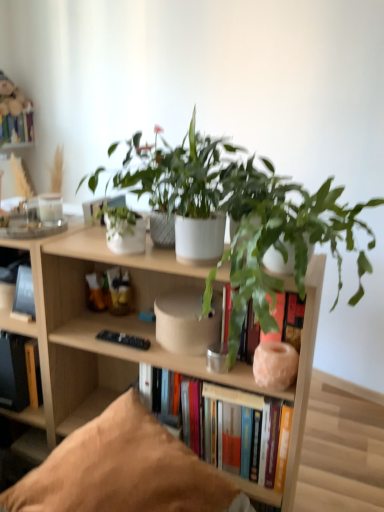
Question: Does point (29, 112) appear closer or farther from the camera than point (9, 497)?

Choices:
 (A) farther
 (B) closer

Answer: (A)

Question: Visually, is hardcover book at upper left, placed as the fourth book when sorted from bottom to top, positioned to the left or to the right of brown fabric pillow at lower center?

Choices:
 (A) left
 (B) right

Answer: (A)

Question: Which object is positioned farthest from the green matte plant at center, positioned as the 1th houseplant in right-to-left order?

Choices:
 (A) hardcover book at upper left, the fourth book when ordered from right to left
 (B) brown fabric pillow at lower center
 (C) white matte pot at upper center, which is the second houseplant in right-to-left order
 (D) hardcover books at center, which is the fourth book in top-to-bottom order
 (E) matte pink stone vase at center

Answer: (A)

Question: Estimate the real-world distances between objects in this image. Which object is farther from the green matte plant at center, which ranks as the second houseplant in left-to-right order?

Choices:
 (A) white matte pot at upper center, which is counted as the 1th houseplant, starting from the left
 (B) hardcover book at left, the second book from the left
 (C) wooden bookcase at center
 (D) matte pink stone vase at center
 (E) brown fabric pillow at lower center

Answer: (B)